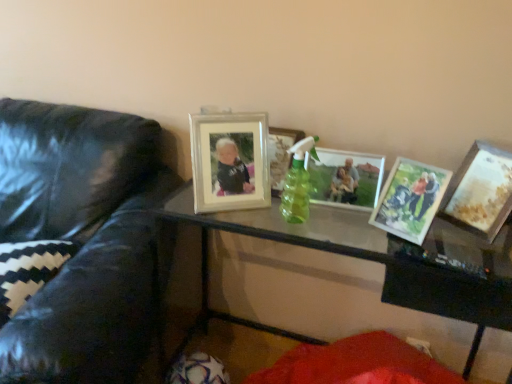
Question: Is matte silver picture frame at center, marked as the 4th picture frame in a right-to-left arrangement, inside the boundaries of black zigzag-patterned pillow at left, or outside?

Choices:
 (A) outside
 (B) inside

Answer: (A)

Question: Looking at their shapes, would you say matte silver picture frame at center, the 2th picture frame when ordered from left to right, is wider or thinner than black zigzag-patterned pillow at left?

Choices:
 (A) thin
 (B) wide

Answer: (A)

Question: Based on their relative distances, which object is farther from the matte silver picture frame at center, marked as the 4th picture frame in a right-to-left arrangement?

Choices:
 (A) white glossy picture frame at upper center, which is the first picture frame from left to right
 (B) matte glass photo frame at center, which is the 3th picture frame from left to right
 (C) black zigzag-patterned pillow at left
 (D) transparent glass table at center
 (E) black leather couch at left

Answer: (C)

Question: Which object is the farthest from the black leather couch at left?

Choices:
 (A) matte glass photo frame at center, the third picture frame positioned from the right
 (B) matte wooden picture frame at center right, which appears as the 2th picture frame when viewed from the right
 (C) white glossy picture frame at upper center, marked as the 5th picture frame in a right-to-left arrangement
 (D) matte silver picture frame at center, marked as the 4th picture frame in a right-to-left arrangement
 (E) wooden photo frame at right, the fifth picture frame when ordered from left to right

Answer: (E)